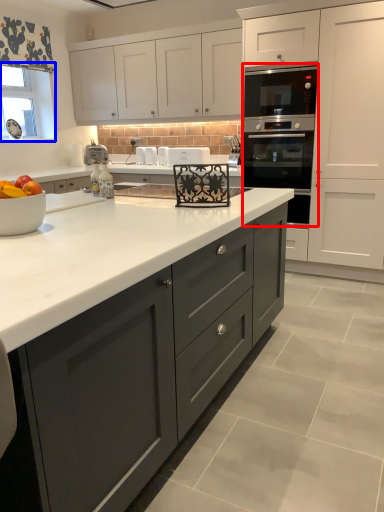
Question: Which of the following is the closest to the observer, oven (highlighted by a red box) or window screen (highlighted by a blue box)?

Choices:
 (A) oven
 (B) window screen

Answer: (A)